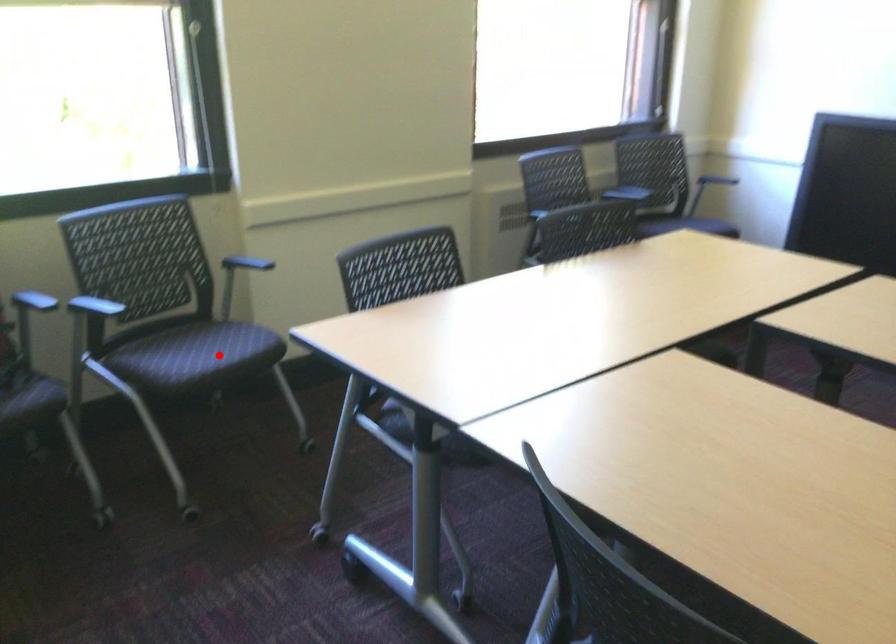
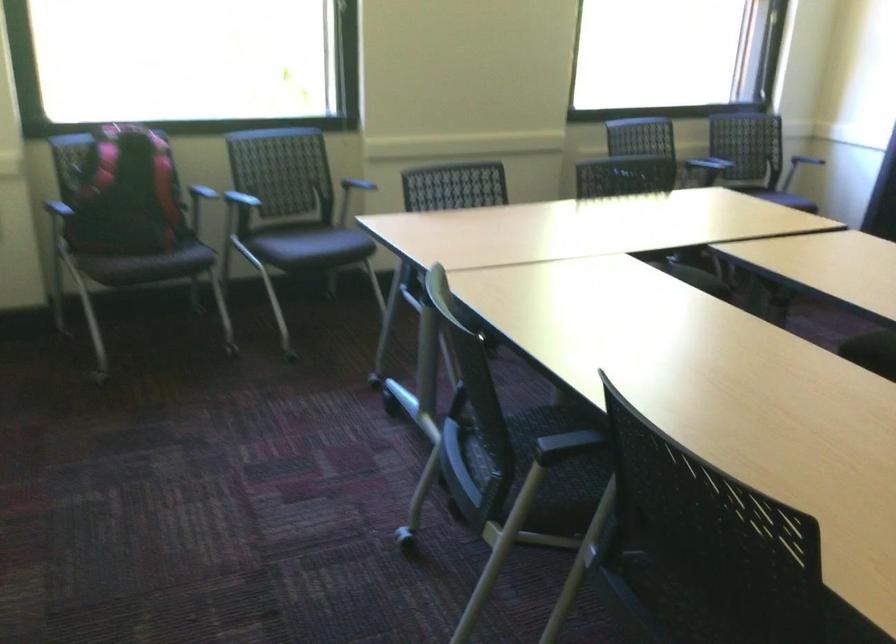
The point at the highlighted location is marked in the first image. Where is the corresponding point in the second image?

(323, 243)